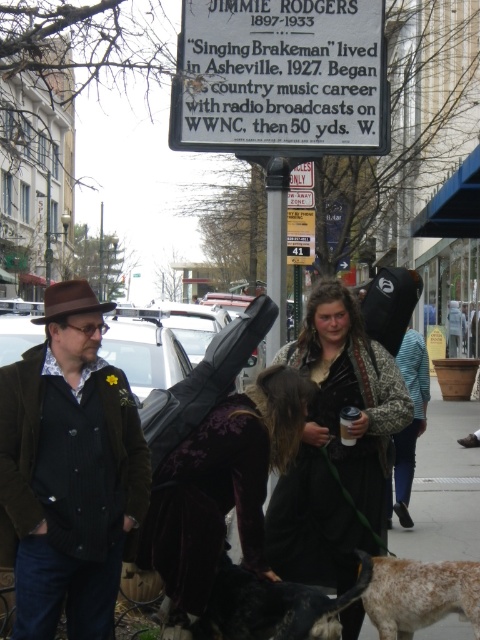
You are standing at point (459,568) and want to walk to point (361,44). Based on the scene description, will you be moving towards the foreground or background?

Since point (361,44) is behind point (459,568), moving from point (459,568) to point (361,44) means you are moving towards the background.

You are a delivery person carrying a package that requires a secure drop point. You see the white plastic sign at upper center and the speckled fur dog at lower right. Which object is farther from your current position if you are standing 2 meters away from both?

Both the white plastic sign at upper center and the speckled fur dog at lower right are 2 meters away from you, so they are equally distant.